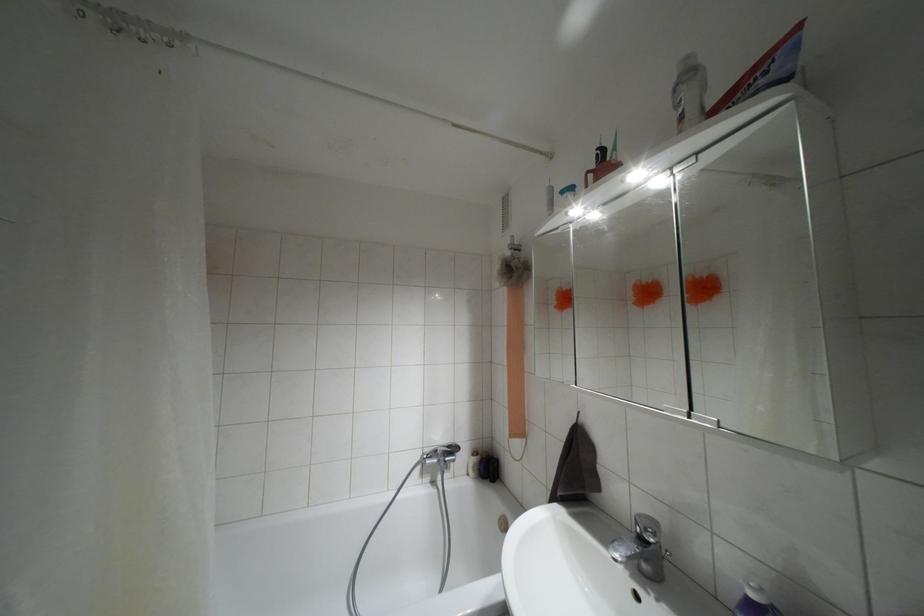
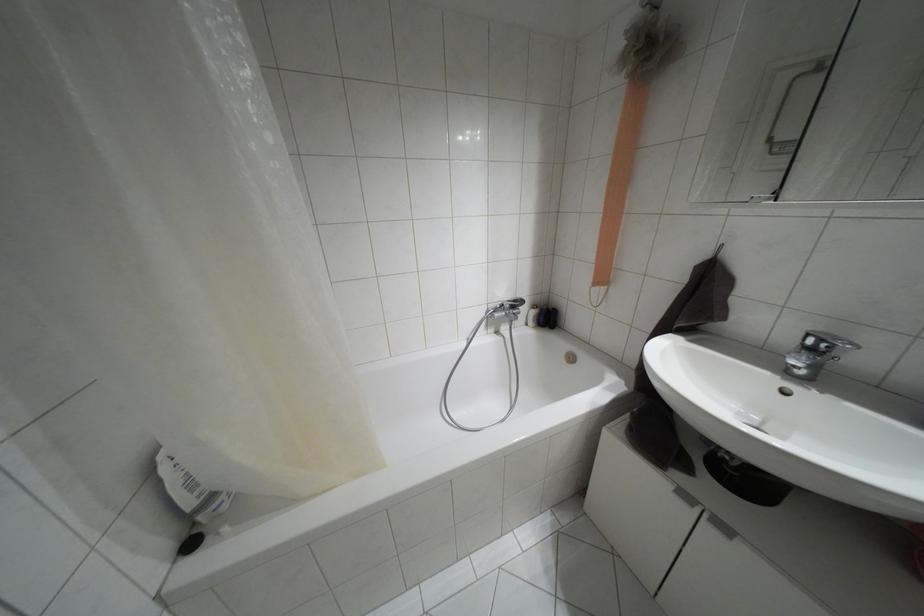
Question: How did the camera likely rotate?

Choices:
 (A) Left
 (B) Right
 (C) Up
 (D) Down

Answer: (D)